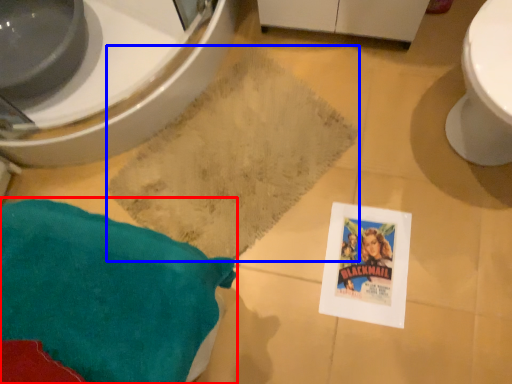
Question: Which point is closer to the camera, throw pillow (highlighted by a red box) or bath mat (highlighted by a blue box)?

Choices:
 (A) throw pillow
 (B) bath mat

Answer: (A)